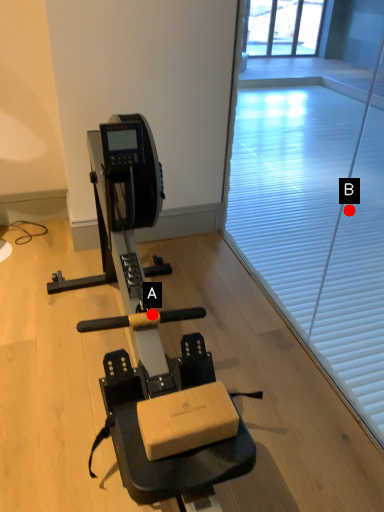
Question: Two points are circled on the image, labeled by A and B beside each circle. Which point is closer to the camera taking this photo?

Choices:
 (A) A is closer
 (B) B is closer

Answer: (A)